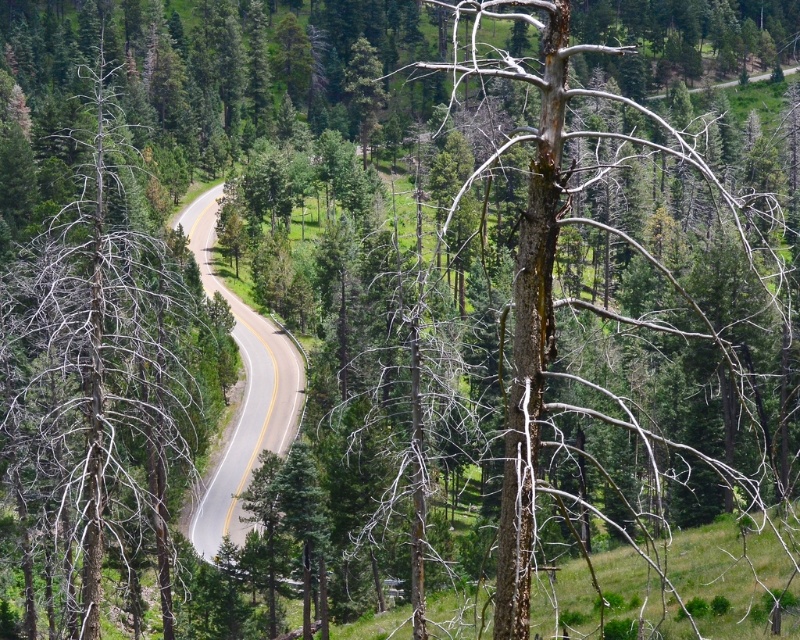
Question: Does dead wood tree at left appear over asphalt road at center?

Choices:
 (A) no
 (B) yes

Answer: (B)

Question: Which object is farther from the camera taking this photo?

Choices:
 (A) dead wood tree at left
 (B) asphalt road at center

Answer: (B)

Question: Which point is farther from the camera taking this photo?

Choices:
 (A) (233, 333)
 (B) (112, 403)

Answer: (A)

Question: Is dead wood tree at left positioned before asphalt road at center?

Choices:
 (A) no
 (B) yes

Answer: (B)

Question: Which point is farther to the camera?

Choices:
 (A) (76, 163)
 (B) (190, 536)

Answer: (A)

Question: Is dead wood tree at left closer to camera compared to asphalt road at center?

Choices:
 (A) yes
 (B) no

Answer: (A)